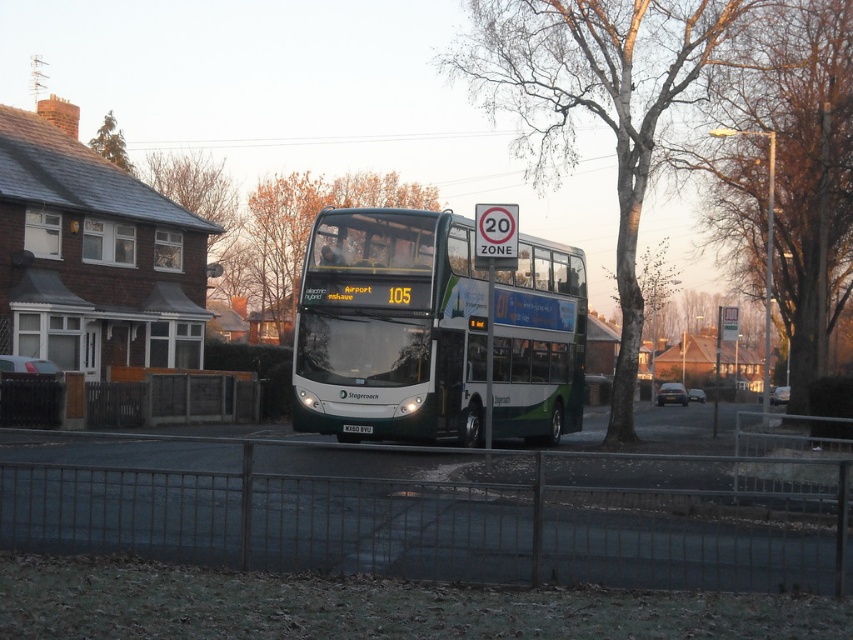
Question: Is green leafy tree at center to the right of black plastic license plate at center from the viewer's perspective?

Choices:
 (A) yes
 (B) no

Answer: (B)

Question: Which object appears closest to the camera in this image?

Choices:
 (A) bare wood tree at center
 (B) green leafy tree at upper left
 (C) green leafy tree at center
 (D) black plastic license plate at center

Answer: (D)

Question: Does green leafy tree at center have a larger size compared to black plastic license plate at center?

Choices:
 (A) yes
 (B) no

Answer: (A)

Question: Can you confirm if bare wood tree at center is positioned above green leafy tree at upper left?

Choices:
 (A) yes
 (B) no

Answer: (B)

Question: Among these points, which one is nearest to the camera?

Choices:
 (A) (665, 44)
 (B) (357, 428)
 (C) (93, 136)

Answer: (B)

Question: Among these objects, which one is nearest to the camera?

Choices:
 (A) green leafy tree at center
 (B) black plastic license plate at center
 (C) green matte/deckbus at center

Answer: (C)